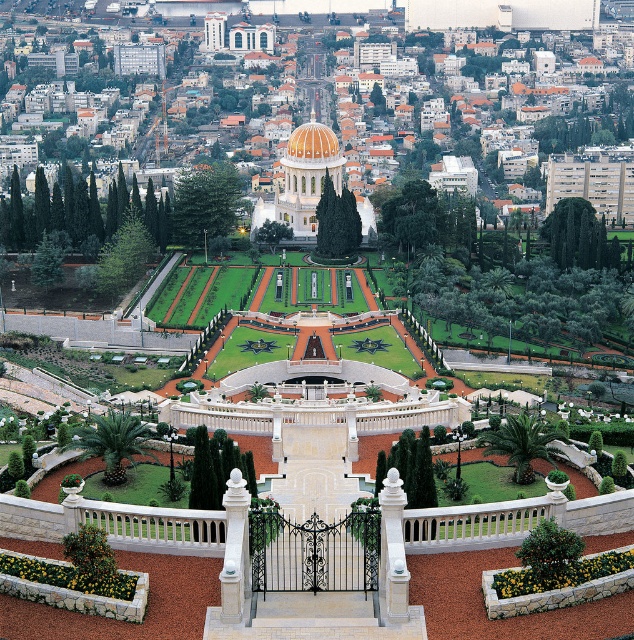
Question: Can you confirm if white marble pillar at center is thinner than golden mosaic dome at center?

Choices:
 (A) yes
 (B) no

Answer: (A)

Question: Which point is farther from the camera taking this photo?

Choices:
 (A) (236, 566)
 (B) (292, 141)
 (C) (387, 493)

Answer: (B)

Question: Does white stone pillar at center appear on the left side of golden mosaic dome at center?

Choices:
 (A) no
 (B) yes

Answer: (A)

Question: Does white stone pillar at center have a lesser width compared to golden mosaic dome at center?

Choices:
 (A) yes
 (B) no

Answer: (A)

Question: Which point appears farthest from the camera in this image?

Choices:
 (A) (238, 506)
 (B) (309, 138)
 (C) (404, 579)

Answer: (B)

Question: Considering the real-world distances, which object is farthest from the white marble dome at center?

Choices:
 (A) white stone pillar at center
 (B) white marble pillar at center
 (C) golden mosaic dome at center

Answer: (B)